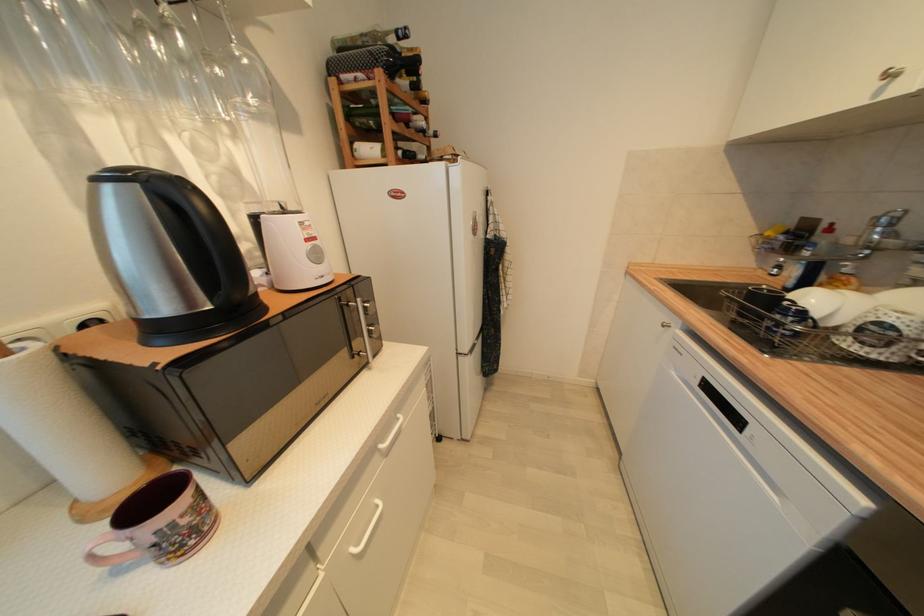
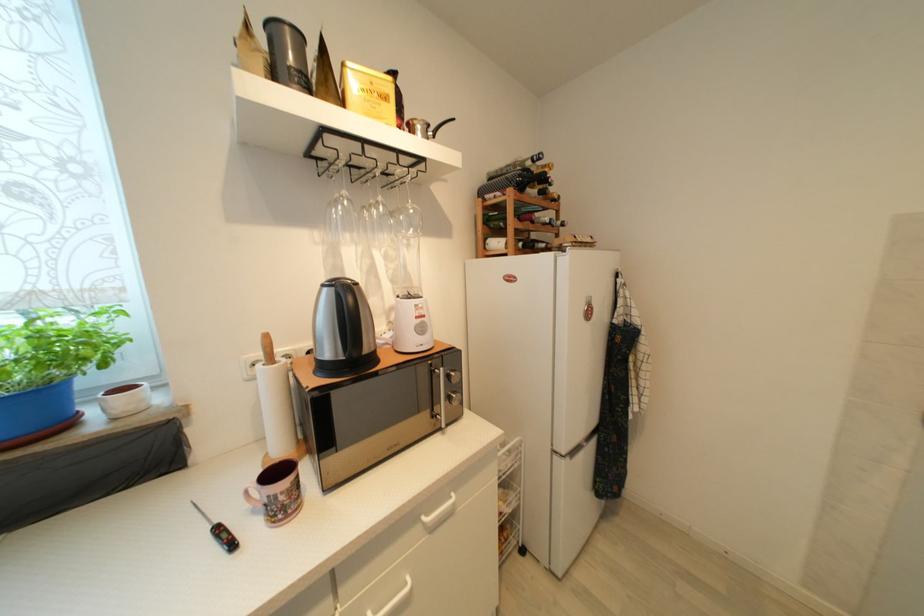
Where in the second image is the point corresponding to (x=373, y=334) from the first image?

(455, 400)